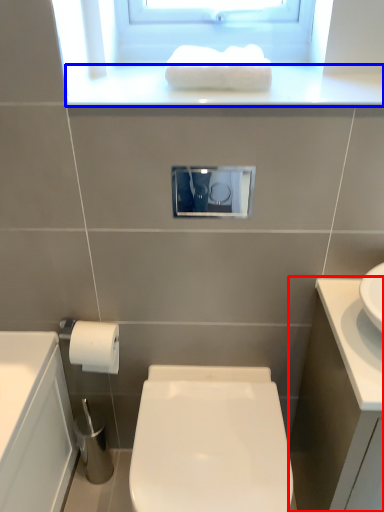
Question: Which object is further to the camera taking this photo, bathroom cabinet (highlighted by a red box) or window sill (highlighted by a blue box)?

Choices:
 (A) bathroom cabinet
 (B) window sill

Answer: (B)